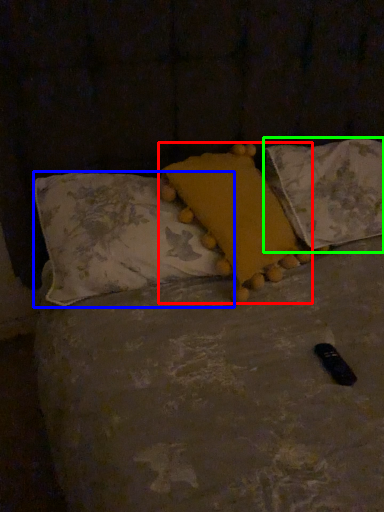
Question: Which is farther away from pillow (highlighted by a red box)? pillow (highlighted by a blue box) or pillow (highlighted by a green box)?

Choices:
 (A) pillow
 (B) pillow

Answer: (B)